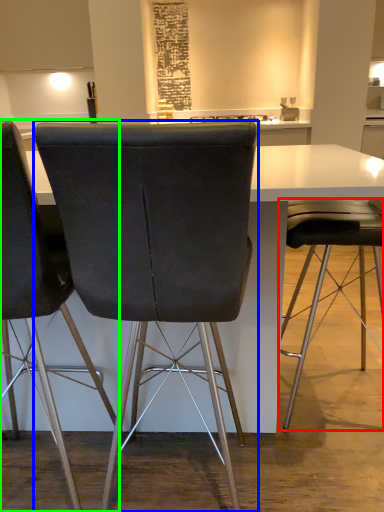
Question: Estimate the real-world distances between objects in this image. Which object is closer to chair (highlighted by a red box), chair (highlighted by a blue box) or chair (highlighted by a green box)?

Choices:
 (A) chair
 (B) chair

Answer: (A)